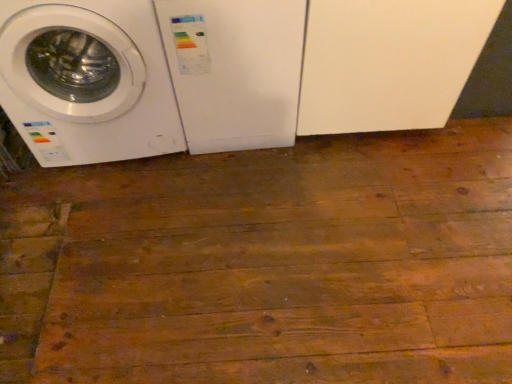
Question: From their relative heights in the image, would you say white plastic washing machine at center, which is the first washing machine from right to left, is taller or shorter than white glossy washing machine at left, which ranks as the 1th washing machine in left-to-right order?

Choices:
 (A) tall
 (B) short

Answer: (B)

Question: Choose the correct answer: Is white plastic washing machine at center, the 2th washing machine viewed from the left, inside white glossy washing machine at left, which ranks as the 1th washing machine in left-to-right order, or outside it?

Choices:
 (A) inside
 (B) outside

Answer: (B)

Question: Is white plastic washing machine at center, the 2th washing machine viewed from the left, to the left or to the right of white glossy washing machine at left, which ranks as the 1th washing machine in left-to-right order, in the image?

Choices:
 (A) right
 (B) left

Answer: (A)

Question: Is point (142, 18) positioned closer to the camera than point (211, 31)?

Choices:
 (A) closer
 (B) farther

Answer: (A)

Question: In the image, is white glossy washing machine at left, positioned as the second washing machine in right-to-left order, positioned in front of or behind white plastic washing machine at center, the 2th washing machine viewed from the left?

Choices:
 (A) front
 (B) behind

Answer: (A)

Question: Choose the correct answer: Is white glossy washing machine at left, positioned as the second washing machine in right-to-left order, inside white plastic washing machine at center, the 2th washing machine viewed from the left, or outside it?

Choices:
 (A) outside
 (B) inside

Answer: (A)

Question: Visually, is white glossy washing machine at left, which ranks as the 1th washing machine in left-to-right order, positioned to the left or to the right of white plastic washing machine at center, which is the first washing machine from right to left?

Choices:
 (A) left
 (B) right

Answer: (A)